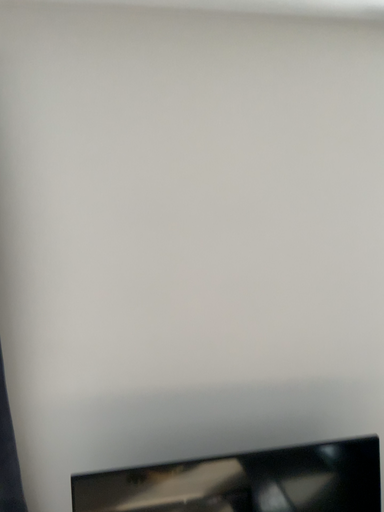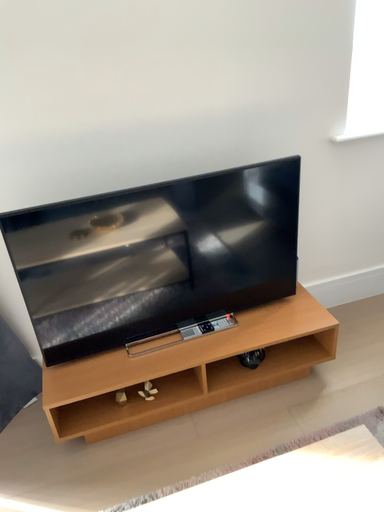
Question: Which way did the camera rotate in the video?

Choices:
 (A) rotated upward
 (B) rotated downward

Answer: (B)